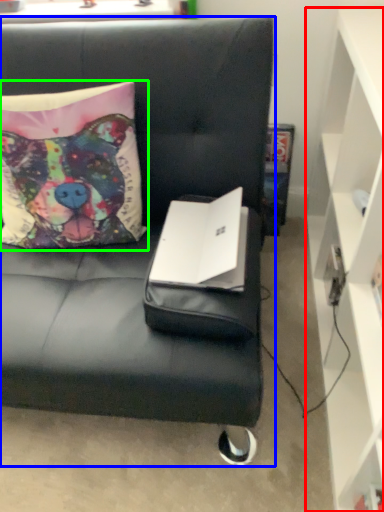
Question: Which is nearer to the cabinetry (highlighted by a red box)? studio couch (highlighted by a blue box) or pillow (highlighted by a green box).

Choices:
 (A) studio couch
 (B) pillow

Answer: (A)